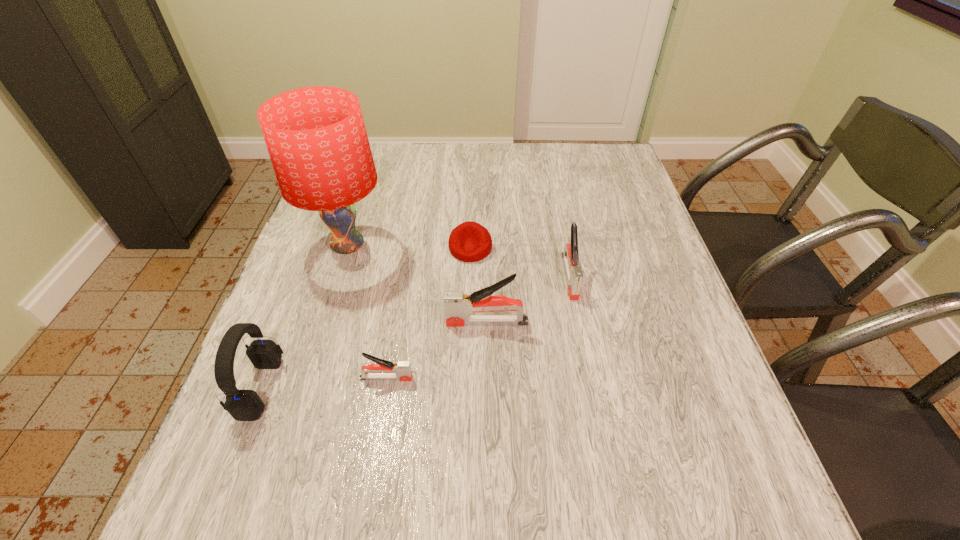
Identify the location of vacant area between the nearest stapler and the beanbag. The width and height of the screenshot is (960, 540). (x=428, y=313).

What are the coordinates of `free spot between the shortest stapler and the beanbag` in the screenshot? It's located at (428, 313).

The width and height of the screenshot is (960, 540). Find the location of `unoccupied area between the third shortest object and the headset`. unoccupied area between the third shortest object and the headset is located at coordinates (416, 332).

Identify the location of free space between the headset and the second farthest stapler. (374, 355).

Identify the location of free spot between the second shortest object and the second tallest stapler. (478, 327).

Find the location of a particular element. The width and height of the screenshot is (960, 540). free spot between the second shortest object and the tallest object is located at coordinates (367, 312).

Where is `free space between the nearest stapler and the beanbag`? Image resolution: width=960 pixels, height=540 pixels. free space between the nearest stapler and the beanbag is located at coordinates (428, 313).

Locate which object ranks second in proximity to the lampshade. Please provide its 2D coordinates. Your answer should be formatted as a tuple, i.e. [(x, y)], where the tuple contains the x and y coordinates of a point satisfying the conditions above.

[(458, 305)]

Identify which object is the fourth closest to the shortest stapler. Please provide its 2D coordinates. Your answer should be formatted as a tuple, i.e. [(x, y)], where the tuple contains the x and y coordinates of a point satisfying the conditions above.

[(469, 242)]

Locate which stapler is the closest to the shortest object. Please provide its 2D coordinates. Your answer should be formatted as a tuple, i.e. [(x, y)], where the tuple contains the x and y coordinates of a point satisfying the conditions above.

[(458, 305)]